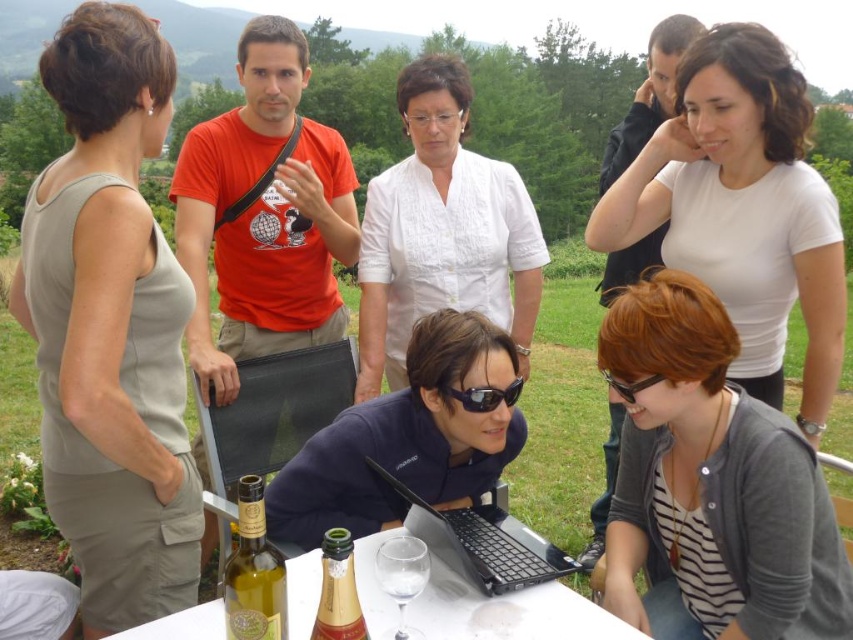
Question: Is white matte shirt at upper center above clear glass wine glass at lower center?

Choices:
 (A) yes
 (B) no

Answer: (A)

Question: Which point appears closest to the camera in this image?

Choices:
 (A) (436, 125)
 (B) (625, 385)

Answer: (B)

Question: Based on their relative distances, which object is nearer to the translucent glass table at lower center?

Choices:
 (A) clear glass wine glass at lower center
 (B) matte beige dress at left

Answer: (A)

Question: Which of these objects is positioned closest to the green glass bottle at lower center?

Choices:
 (A) black plastic goggles at lower center
 (B) black plastic laptop at center
 (C) white matte shirt at upper center

Answer: (B)

Question: Is black plastic laptop at center further to the viewer compared to gold foil champagne bottle at center?

Choices:
 (A) yes
 (B) no

Answer: (A)

Question: Does white cotton blouse at center appear on the left side of clear glass wine glass at lower center?

Choices:
 (A) yes
 (B) no

Answer: (B)